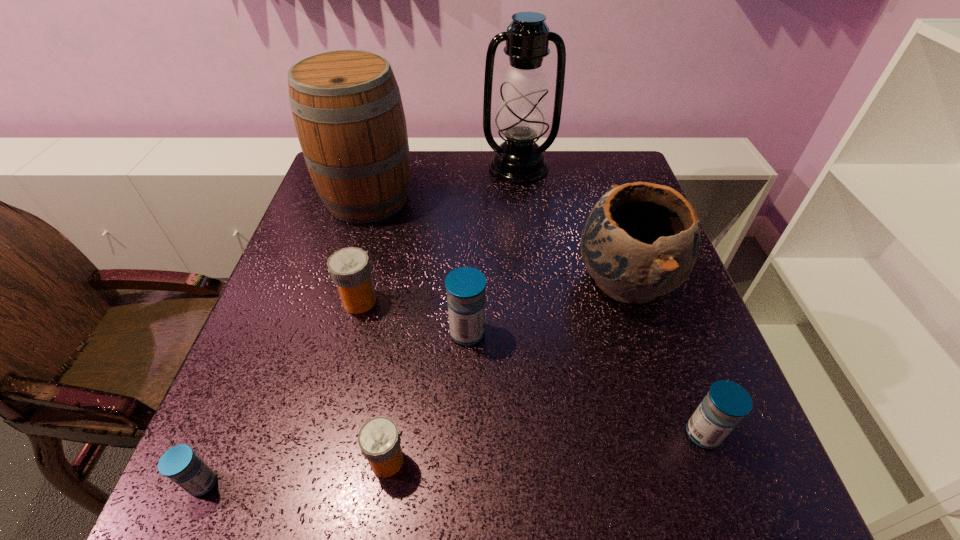
At what (x,y) coordinates should I click in order to perform the action: click on free area in between the rightmost medicine and the cider. Please return your answer as a coordinate pair (x, y). The width and height of the screenshot is (960, 540). Looking at the image, I should click on (535, 316).

Where is `free space that is in between the sixth shortest object and the second farthest blue medicine`? The image size is (960, 540). free space that is in between the sixth shortest object and the second farthest blue medicine is located at coordinates (664, 357).

Identify the location of vacant area that lies between the smallest blue medicine and the fifth object from right to left. (295, 472).

I want to click on free space that is in between the third medicine from left to right and the smallest blue medicine, so click(x=295, y=472).

Select which object is the fourth closest to the seventh shortest object. Please provide its 2D coordinates. Your answer should be formatted as a tuple, i.e. [(x, y)], where the tuple contains the x and y coordinates of a point satisfying the conditions above.

[(641, 240)]

Locate an element on the screen. This screenshot has width=960, height=540. object that is the fifth closest to the oil lamp is located at coordinates (726, 403).

Locate an element on the screen. The width and height of the screenshot is (960, 540). medicine that is the closest to the second biggest blue medicine is located at coordinates (465, 286).

Identify the location of the fourth closest medicine relative to the black oil lamp. (379, 440).

Find the location of `blue medicine that can be found as the second closest to the third tallest object`. blue medicine that can be found as the second closest to the third tallest object is located at coordinates (465, 286).

Point out which blue medicine is positioned as the second nearest to the black oil lamp. Please provide its 2D coordinates. Your answer should be formatted as a tuple, i.e. [(x, y)], where the tuple contains the x and y coordinates of a point satisfying the conditions above.

[(726, 403)]